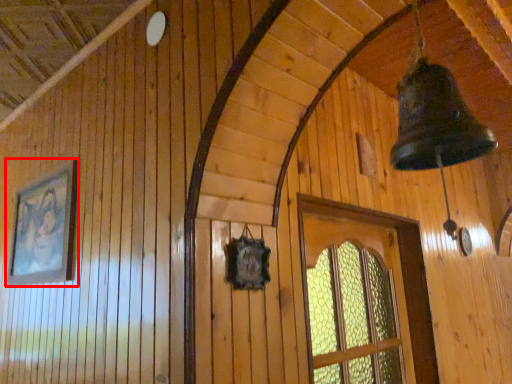
Question: From the image's perspective, what is the correct spatial relationship of picture frame (annotated by the red box) in relation to window?

Choices:
 (A) above
 (B) below

Answer: (A)